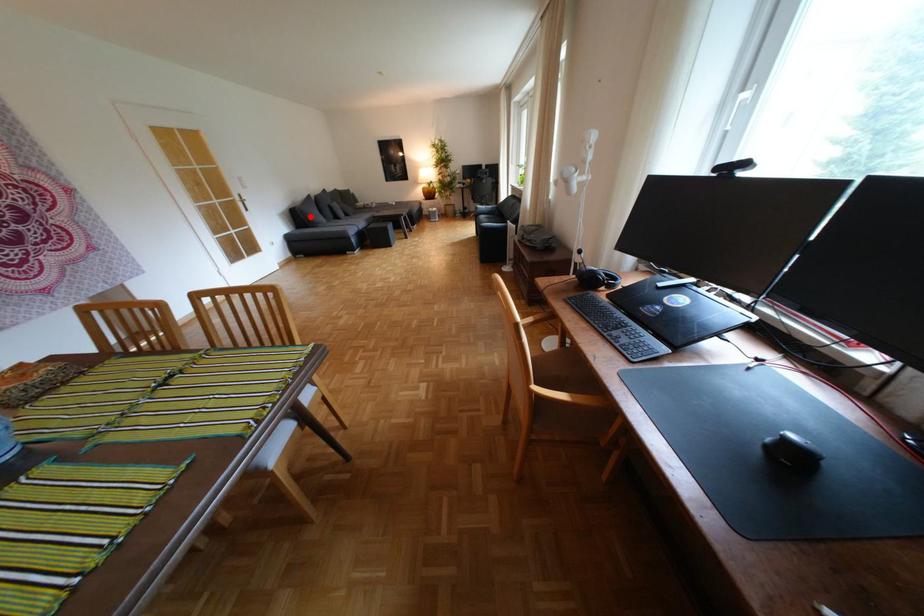
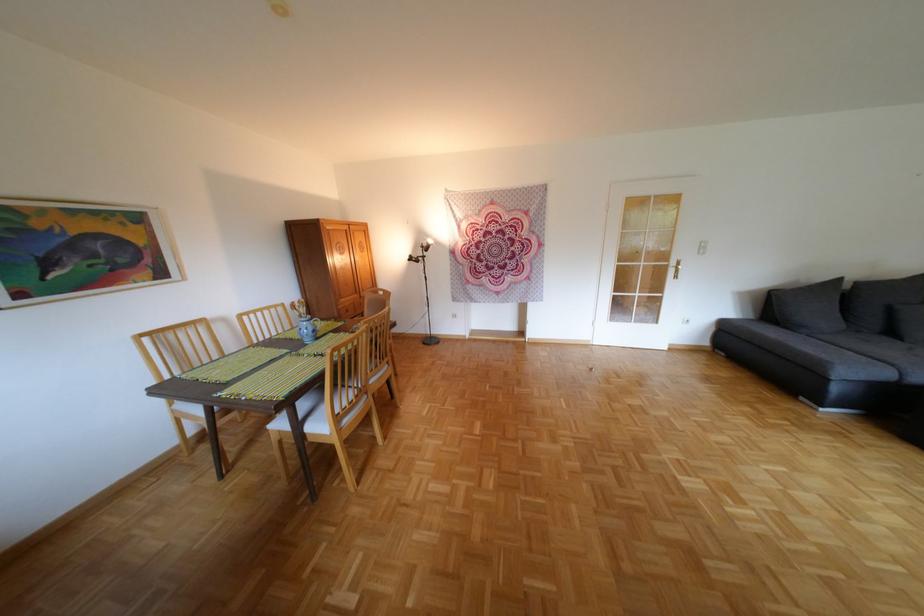
Question: I am providing you with two images of the same scene from different viewpoints. Given a red point in image1, look at the same physical point in image2. Is it:

Choices:
 (A) Closer to the viewpoint
 (B) Farther from the viewpoint

Answer: (B)